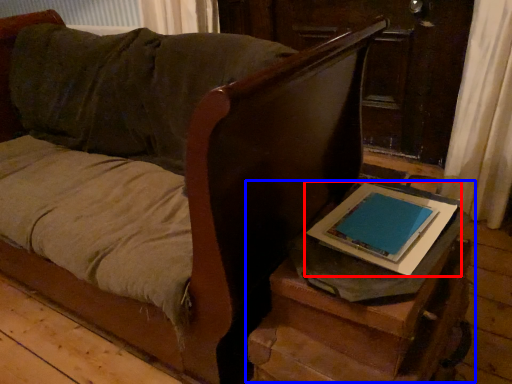
Question: Among these objects, which one is farthest to the camera, tablet computer (highlighted by a red box) or table (highlighted by a blue box)?

Choices:
 (A) tablet computer
 (B) table

Answer: (A)